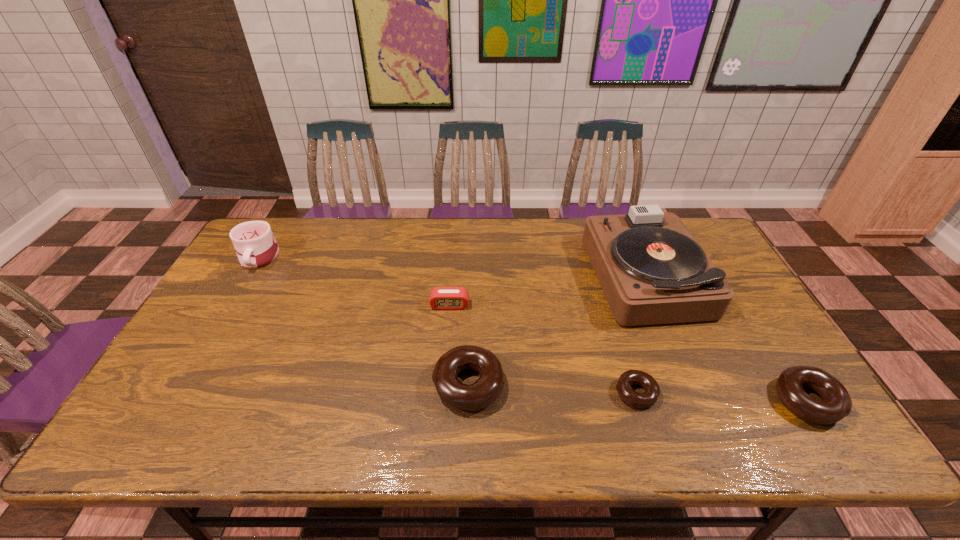
You are a GUI agent. You are given a task and a screenshot of the screen. Output one action in this format:
    pyautogui.click(x=<x>, y=<y>)
    Task: Click on the empty space between the rightmost doughnut and the second doughnut from left to right
    
    Given the screenshot: What is the action you would take?
    pyautogui.click(x=722, y=397)

In order to click on vacant area that lies between the tallest object and the mug in this screenshot , I will do `click(452, 266)`.

Where is `free spot between the leftmost doughnut and the shortest object`? Image resolution: width=960 pixels, height=540 pixels. free spot between the leftmost doughnut and the shortest object is located at coordinates pyautogui.click(x=552, y=389).

Where is `free space between the record player and the leftmost object`? The height and width of the screenshot is (540, 960). free space between the record player and the leftmost object is located at coordinates (452, 266).

The image size is (960, 540). I want to click on empty space between the record player and the alarm clock, so click(547, 290).

In order to click on free space between the mug and the leftmost doughnut in this screenshot , I will do `click(364, 321)`.

Image resolution: width=960 pixels, height=540 pixels. I want to click on vacant space that's between the tallest object and the leftmost doughnut, so click(x=557, y=330).

Identify the location of object that is the nearest to the leftmost doughnut. The height and width of the screenshot is (540, 960). (441, 298).

At what (x,y) coordinates should I click in order to perform the action: click on object that is the fourth closest to the mug. Please return your answer as a coordinate pair (x, y). The width and height of the screenshot is (960, 540). Looking at the image, I should click on (635, 399).

Find the location of a particular element. The height and width of the screenshot is (540, 960). doughnut object that ranks as the third closest to the fifth shortest object is located at coordinates (836, 404).